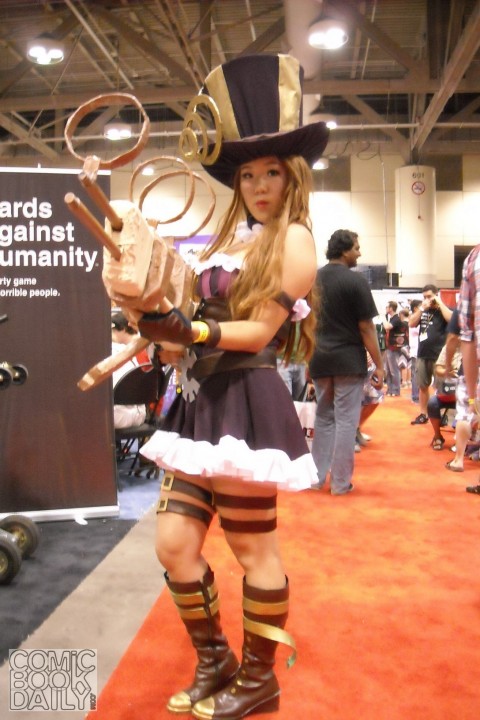
Identify the location of black carpet. (50, 577).